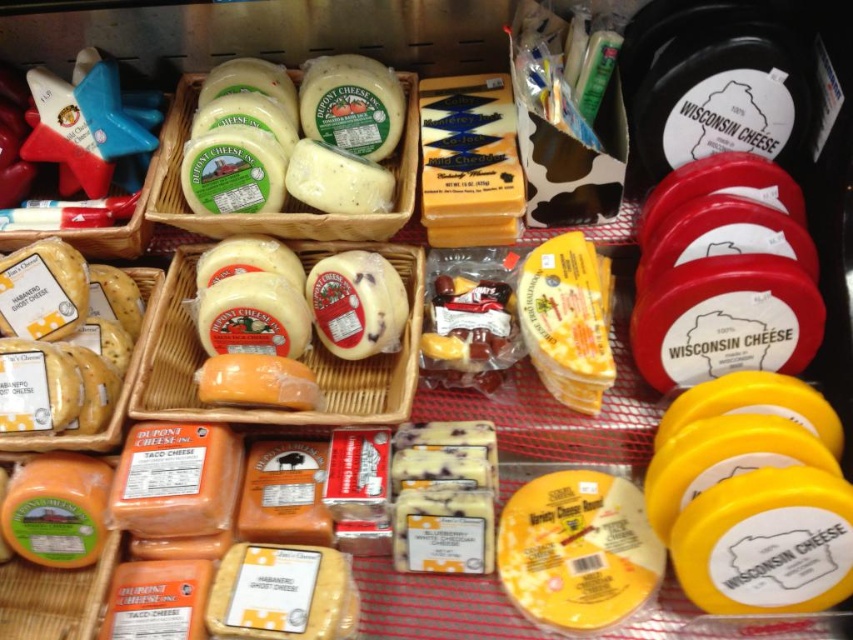
Between point (569, 568) and point (338, 403), which one is positioned in front?

Point (569, 568)

Is yellow matte variety cheese round at center wider than matte plastic cheese at center?

In fact, yellow matte variety cheese round at center might be narrower than matte plastic cheese at center.

Who is more distant from viewer, [579,484] or [386,355]?

The point [386,355] is more distant.

This screenshot has height=640, width=853. Identify the location of yellow matte variety cheese round at center. (577, 552).

Can you confirm if white paperboard cheese at center is positioned below yellow cheese at left?

No.

Which is more to the left, white paperboard cheese at center or yellow cheese at left?

Positioned to the left is yellow cheese at left.

Does point (326, 224) come farther from viewer compared to point (144, 285)?

No, it is not.

Where is `white paperboard cheese at center`? white paperboard cheese at center is located at coordinates (286, 195).

Can you confirm if matte plastic cheese at center is positioned above white paperboard cheese at center?

Actually, matte plastic cheese at center is below white paperboard cheese at center.

Can you confirm if matte plastic cheese at center is thinner than white paperboard cheese at center?

Correct, matte plastic cheese at center's width is less than white paperboard cheese at center's.

Who is more distant from viewer, (329,356) or (410,97)?

The point (410,97) is behind.

At what (x,y) coordinates should I click in order to perform the action: click on matte plastic cheese at center. Please return your answer as a coordinate pair (x, y). Looking at the image, I should click on (299, 356).